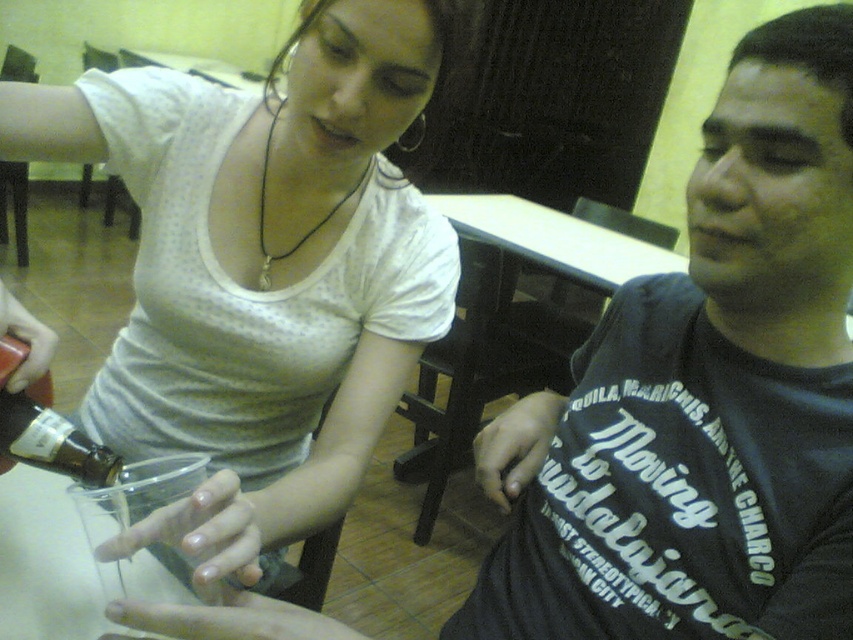
Question: Is white plastic table at center below matte glass bottle at lower left?

Choices:
 (A) yes
 (B) no

Answer: (B)

Question: Which point is closer to the camera?

Choices:
 (A) matte glass bottle at lower left
 (B) white plastic table at center
 (C) matte white shirt at upper left

Answer: (C)

Question: Is white plastic table at center below matte glass bottle at lower left?

Choices:
 (A) no
 (B) yes

Answer: (A)

Question: Which of the following is the closest to the observer?

Choices:
 (A) matte white shirt at upper left
 (B) white plastic table at center

Answer: (A)

Question: Which point appears farthest from the camera in this image?

Choices:
 (A) (258, 330)
 (B) (486, 205)
 (C) (3, 355)

Answer: (B)

Question: Where is matte white shirt at upper left located in relation to matte glass bottle at lower left in the image?

Choices:
 (A) left
 (B) right

Answer: (B)